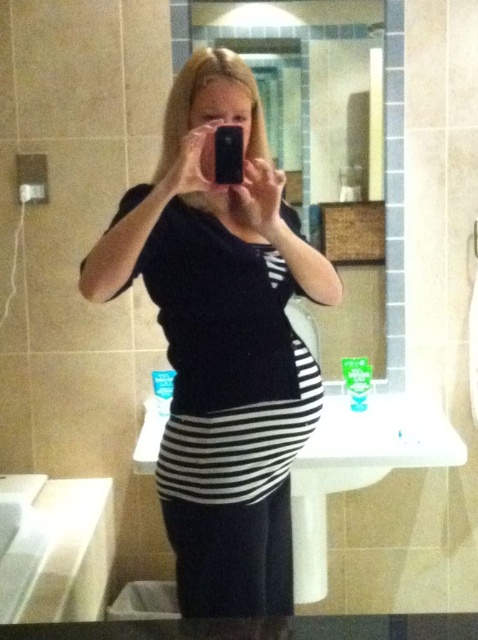
You are trying to take a selfie in the bathroom. You notice the black striped shirt at center and the glossy plastic mirror at upper center. Which object is wider?

The black striped shirt at center is less wide than the glossy plastic mirror at upper center, so the glossy plastic mirror at upper center is wider.

You are trying to take a selfie in the bathroom. You notice the black striped shirt at center and the glossy plastic mirror at upper center. Which object is larger in the image?

The black striped shirt at center is bigger than the glossy plastic mirror at upper center, so the black striped shirt at center is larger.